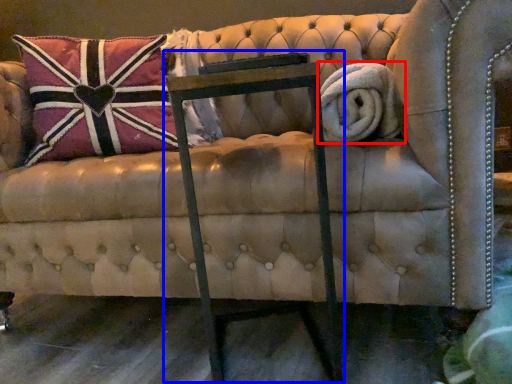
Question: Which object is closer to the camera taking this photo, bath towel (highlighted by a red box) or rocking chair (highlighted by a blue box)?

Choices:
 (A) bath towel
 (B) rocking chair

Answer: (B)